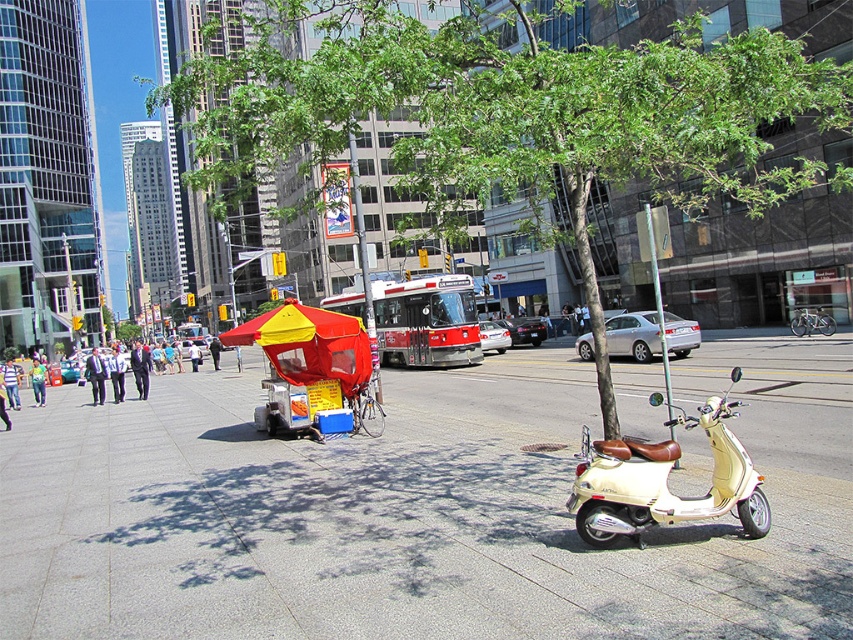
You are a pedestrian standing on the sidewalk and want to take a photo of the red fabric umbrella at center without the green leafy tree at center blocking the view. Which direction should you move to achieve this?

The green leafy tree at center is closer to the viewer than the red fabric umbrella at center. To avoid the tree blocking the view of the umbrella, you should move to the side so that the tree is no longer between you and the umbrella. Moving sideways either to the left or right would allow you to position yourself where the tree does not obstruct the umbrella in your frame.